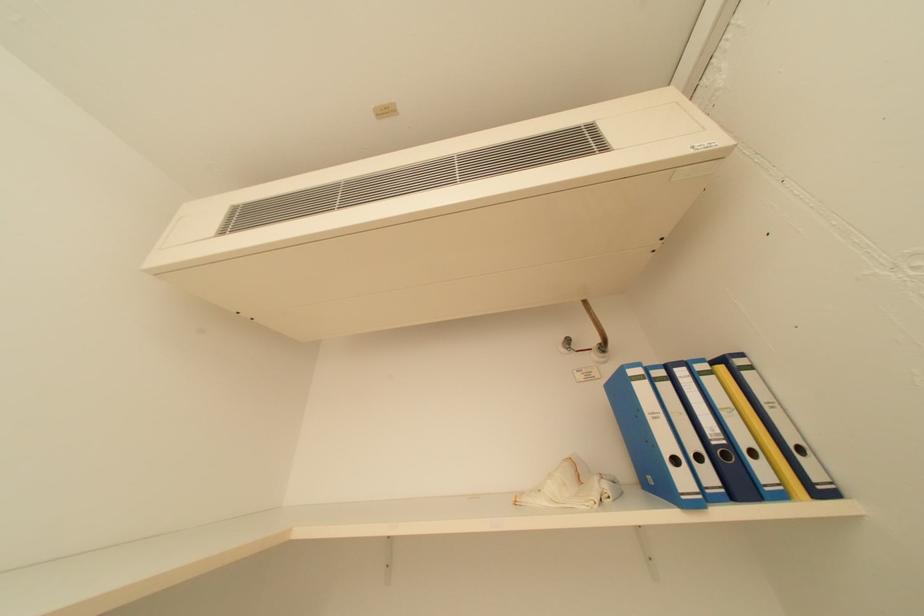
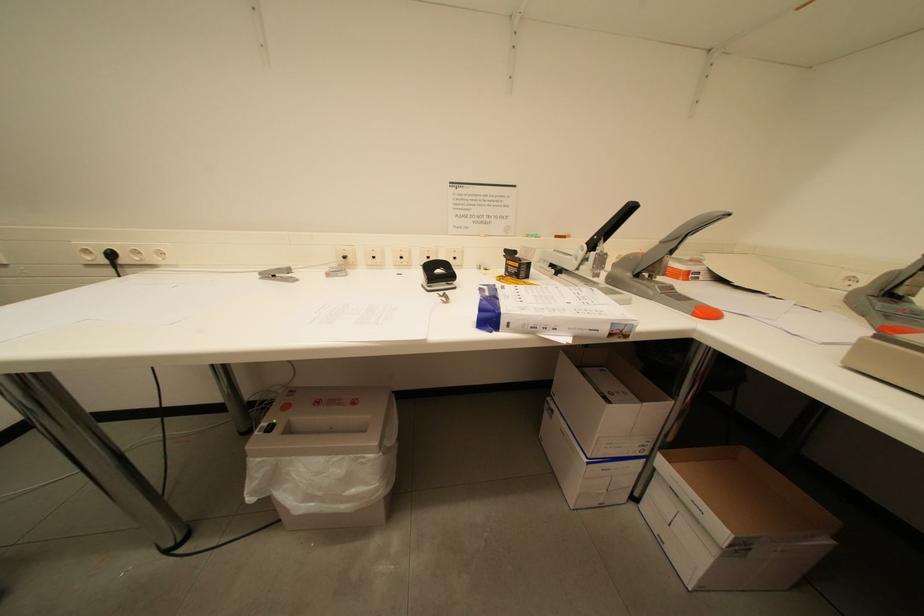
First-person continuous shooting, in which direction is the camera rotating?

The rotation direction of the camera is left-down.